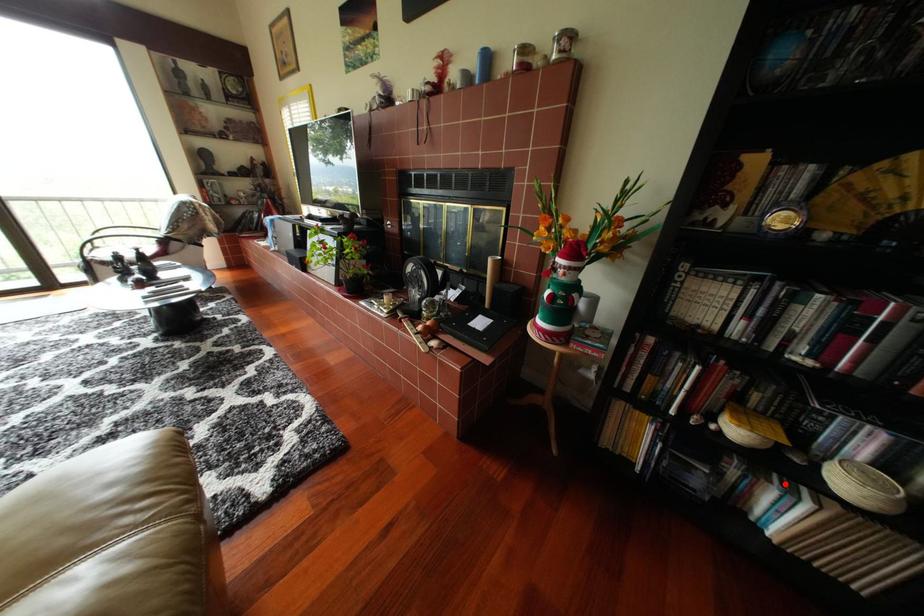
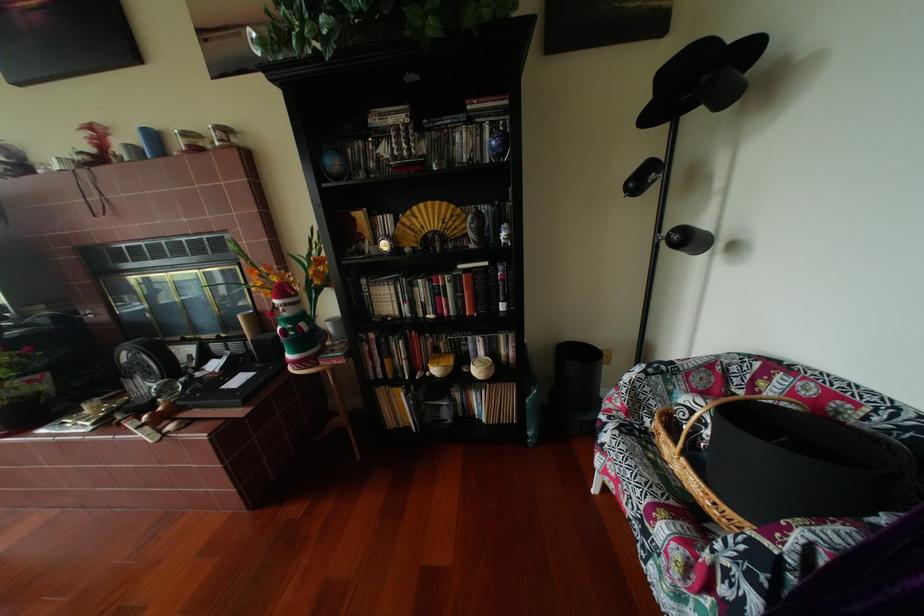
Question: I am providing you with two images of the same scene from different viewpoints. In image1, a red point is highlighted. Considering the same 3D point in image2, which of the following is correct?

Choices:
 (A) It is closer
 (B) It is farther

Answer: (B)